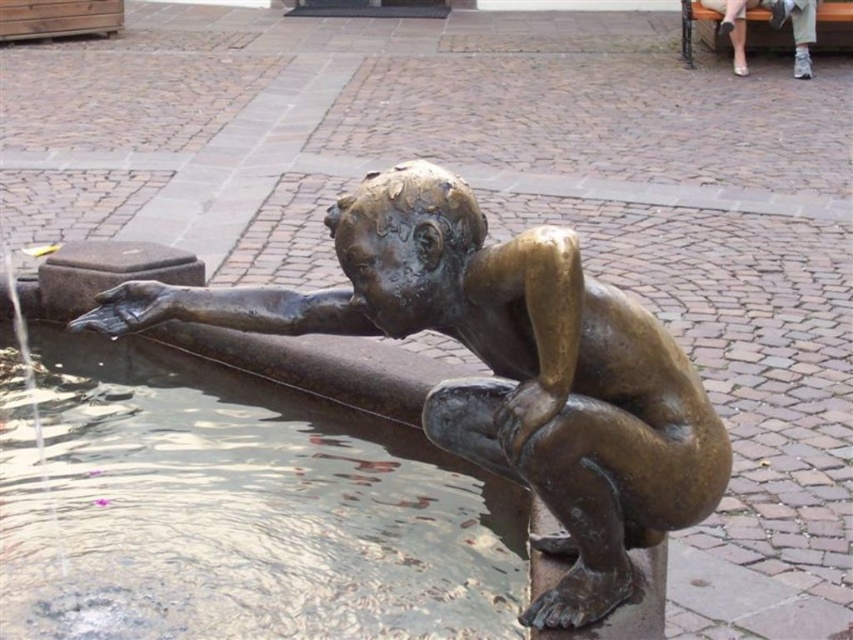
Question: Considering the real-world distances, which object is closest to the clear water at statue center?

Choices:
 (A) metallic silver shoes at upper right
 (B) bronze statue at center

Answer: (B)

Question: Among these points, which one is nearest to the camera?

Choices:
 (A) (679, 483)
 (B) (294, 403)

Answer: (A)

Question: Based on their relative distances, which object is farther from the metallic silver shoes at upper right?

Choices:
 (A) bronze statue at center
 (B) clear water at statue center

Answer: (A)

Question: Where is clear water at statue center located in relation to metallic silver shoes at upper right in the image?

Choices:
 (A) right
 (B) left

Answer: (B)

Question: Does clear water at statue center have a larger size compared to bronze statue at center?

Choices:
 (A) yes
 (B) no

Answer: (A)

Question: Is clear water at statue center bigger than bronze statue at center?

Choices:
 (A) no
 (B) yes

Answer: (B)